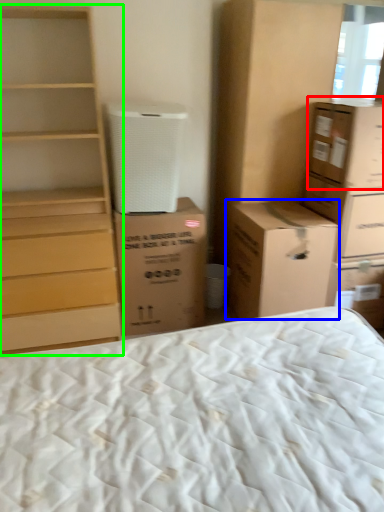
Question: Estimate the real-world distances between objects in this image. Which object is closer to cardboard box (highlighted by a red box), cardboard box (highlighted by a blue box) or chest of drawers (highlighted by a green box)?

Choices:
 (A) cardboard box
 (B) chest of drawers

Answer: (A)